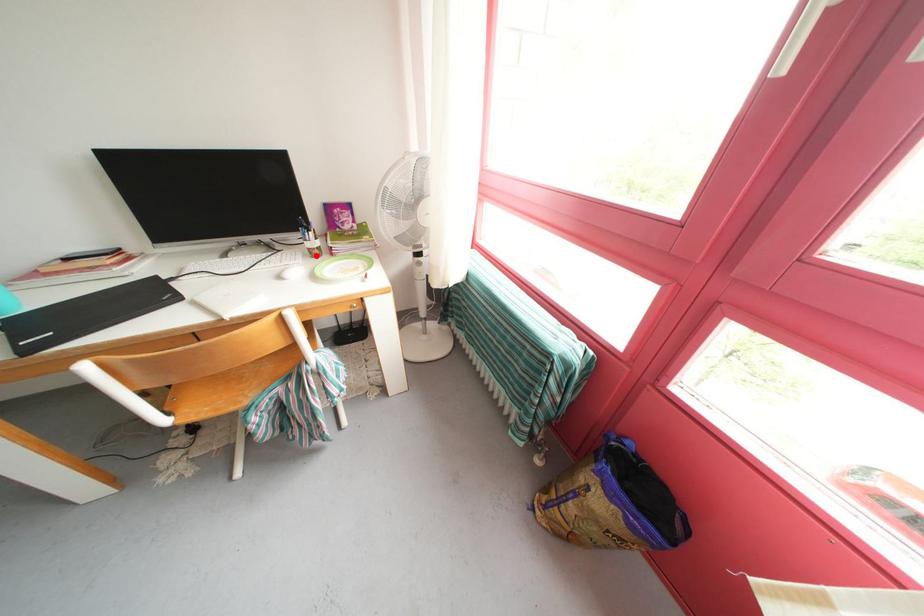
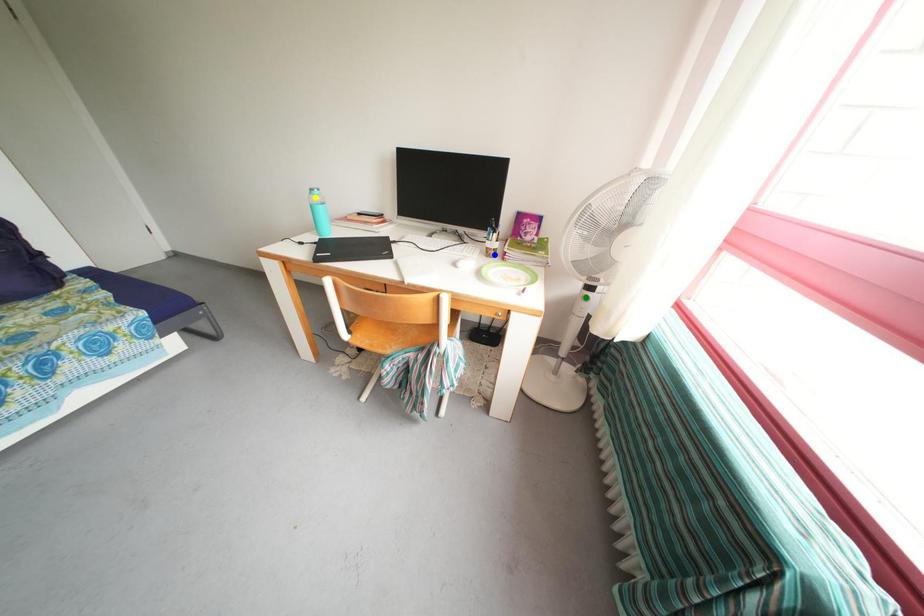
Question: I am providing you with two images of the same scene from different viewpoints. A red point is marked on the first image. You are given multiple points on the second image. Which point in image 2 is actually the same real-world point as the red point in image 1?

Choices:
 (A) yellow point
 (B) blue point
 (C) green point

Answer: (B)